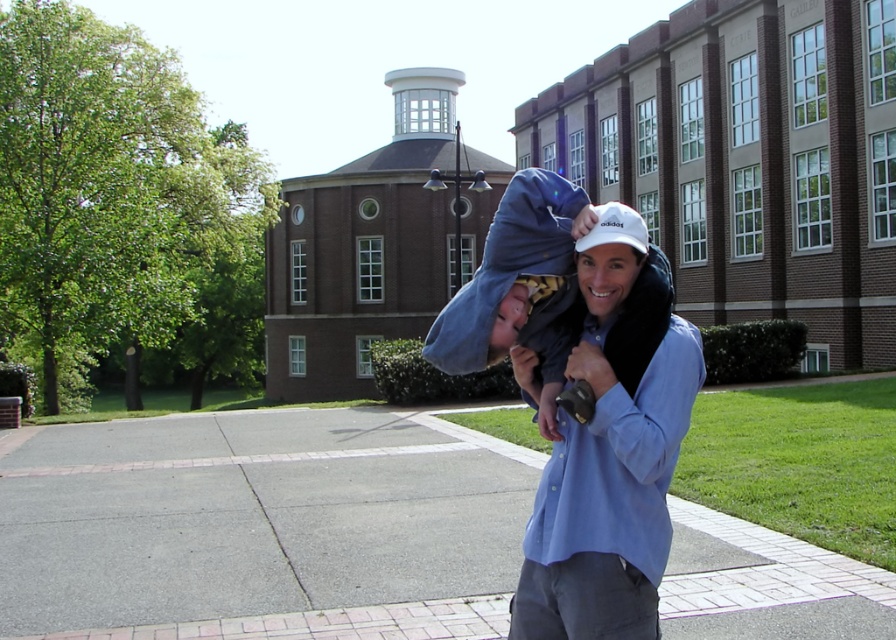
Can you confirm if blue cotton shirt at center is positioned above white matte cap at center?

No.

Image resolution: width=896 pixels, height=640 pixels. Find the location of `blue cotton shirt at center`. blue cotton shirt at center is located at coordinates (610, 454).

Find the location of `blue cotton shirt at center`. blue cotton shirt at center is located at coordinates (610, 454).

Does gray concrete pavement at center have a larger size compared to blue cotton shirt at center?

Indeed, gray concrete pavement at center has a larger size compared to blue cotton shirt at center.

Between gray concrete pavement at center and blue cotton shirt at center, which one is positioned higher?

blue cotton shirt at center

Between point (670, 593) and point (640, 628), which one is positioned in front?

Point (640, 628) is in front.

I want to click on gray concrete pavement at center, so [x=261, y=525].

What do you see at coordinates (610, 259) in the screenshot? I see `white matte cap at center` at bounding box center [610, 259].

Between point (627, 260) and point (519, 317), which one is positioned behind?

The point (519, 317) is behind.

This screenshot has height=640, width=896. Find the location of `white matte cap at center`. white matte cap at center is located at coordinates (610, 259).